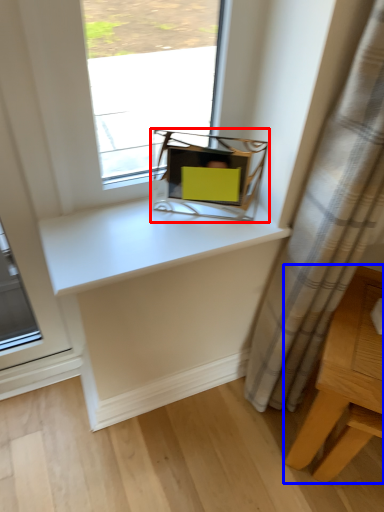
Question: Which object is further to the camera taking this photo, equipment (highlighted by a red box) or table (highlighted by a blue box)?

Choices:
 (A) equipment
 (B) table

Answer: (A)